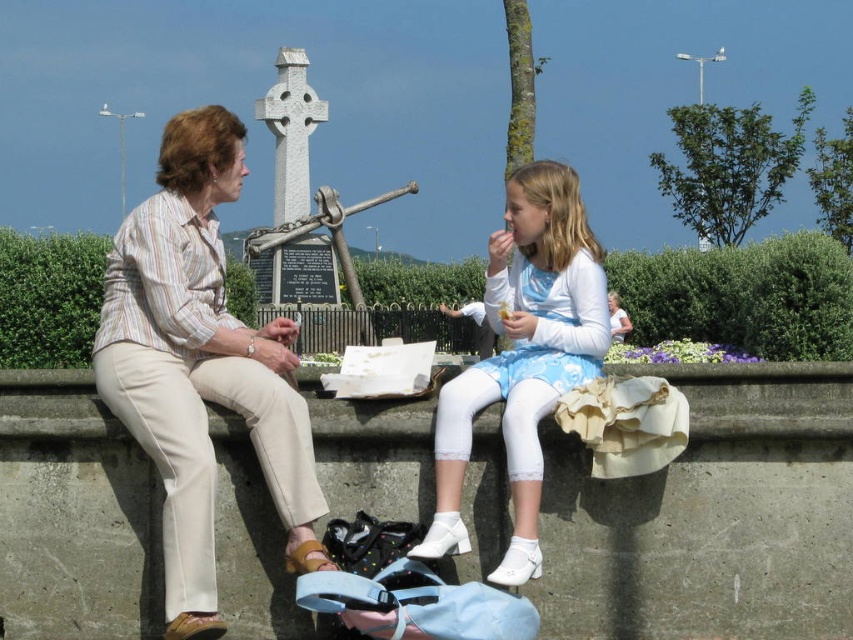
You are standing at the camera position and want to throw a small ball to the beige cotton pants at left. Can you reach it with a throw?

The beige cotton pants at left is 42.12 meters away from the camera, so you cannot reach it with a throw from the camera position.

What is located at the coordinates point (743, 296) in the image?

The point (743, 296) indicates a green leafy hedge at center.

You are a photographer trying to capture a portrait of the beige cotton pants at left and the green leafy hedge at center. Which object should you focus on first if you want to ensure both are in focus without adjusting the camera settings?

The beige cotton pants at left is taller than the green leafy hedge at center, so focusing on the beige cotton pants at left first would help ensure both are in focus since it is closer to the camera.